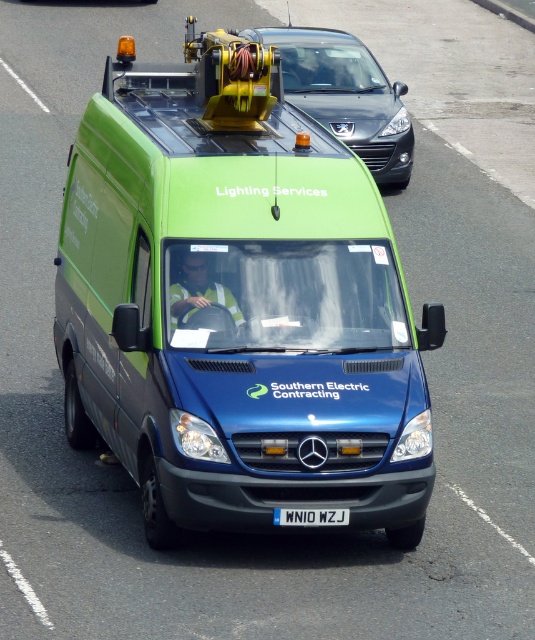
Between point (309, 72) and point (287, 522), which one is positioned in front?

Point (287, 522)

Which is behind, point (377, 113) or point (274, 516)?

Positioned behind is point (377, 113).

This screenshot has width=535, height=640. I want to click on matte black car at upper center, so click(x=346, y=96).

Can you confirm if green matte van at center is positioned to the right of white plastic license plate at center?

In fact, green matte van at center is to the left of white plastic license plate at center.

Which is behind, point (220, 337) or point (347, 509)?

The point (220, 337) is more distant.

Which is behind, point (262, 280) or point (325, 509)?

Positioned behind is point (262, 280).

At what (x,y) coordinates should I click in order to perform the action: click on green matte van at center. Please return your answer as a coordinate pair (x, y). The width and height of the screenshot is (535, 640). Looking at the image, I should click on (236, 305).

Image resolution: width=535 pixels, height=640 pixels. What do you see at coordinates (236, 305) in the screenshot?
I see `green matte van at center` at bounding box center [236, 305].

Does green matte van at center appear on the left side of matte black car at upper center?

Yes, green matte van at center is to the left of matte black car at upper center.

Which is in front, point (180, 484) or point (363, 138)?

Positioned in front is point (180, 484).

The image size is (535, 640). Find the location of `green matte van at center`. green matte van at center is located at coordinates (236, 305).